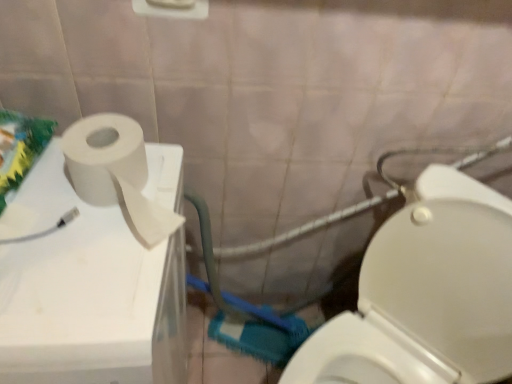
Find the location of a particular element. Image resolution: width=512 pixels, height=384 pixels. free spot in front of white matte toilet paper at left is located at coordinates (83, 287).